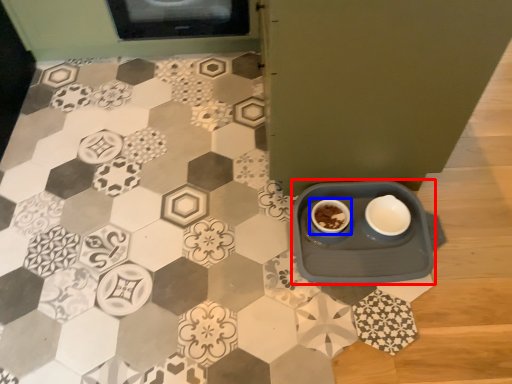
Question: Which object appears closest to the camera in this image, table (highlighted by a red box) or coffee cup (highlighted by a blue box)?

Choices:
 (A) table
 (B) coffee cup

Answer: (A)